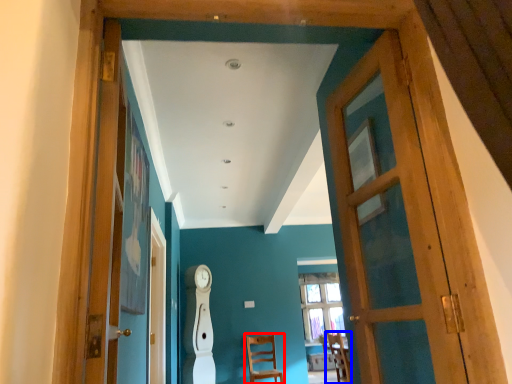
Question: Which point is further to the camera, chair (highlighted by a red box) or chair (highlighted by a blue box)?

Choices:
 (A) chair
 (B) chair

Answer: (A)